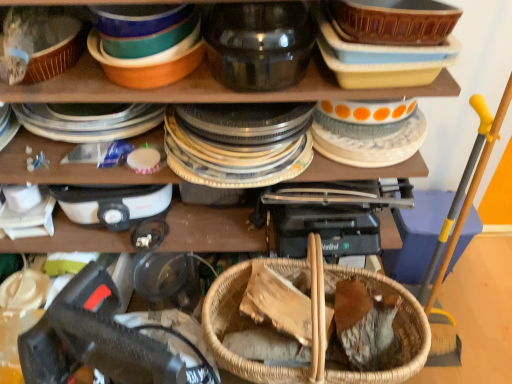
Question: Can you confirm if white glossy plate at upper right, the 2th tableware positioned from the left, is wider than woven wood basket at center?

Choices:
 (A) yes
 (B) no

Answer: (A)

Question: Can you confirm if white glossy plate at upper right, the 2th tableware positioned from the left, is shorter than woven wood basket at center?

Choices:
 (A) no
 (B) yes

Answer: (B)

Question: Does white glossy plate at upper right, the 2th tableware positioned from the left, contain woven wood basket at center?

Choices:
 (A) no
 (B) yes

Answer: (A)

Question: From the image's perspective, is white glossy plate at upper right, the 2th tableware positioned from the left, under woven wood basket at center?

Choices:
 (A) yes
 (B) no

Answer: (B)

Question: Is woven wood basket at center at the back of white glossy plate at upper right, the 2th tableware positioned from the left?

Choices:
 (A) yes
 (B) no

Answer: (B)

Question: Is white glossy plate at upper right, placed as the first tableware when sorted from right to left, bigger or smaller than white plastic appliance at upper left?

Choices:
 (A) big
 (B) small

Answer: (B)

Question: Considering the relative positions of white glossy plate at upper right, the 2th tableware positioned from the left, and white plastic appliance at upper left in the image provided, is white glossy plate at upper right, the 2th tableware positioned from the left, to the left or to the right of white plastic appliance at upper left?

Choices:
 (A) left
 (B) right

Answer: (B)

Question: From the image's perspective, is white glossy plate at upper right, placed as the first tableware when sorted from right to left, above or below white plastic appliance at upper left?

Choices:
 (A) below
 (B) above

Answer: (B)

Question: Does point (419, 135) appear closer or farther from the camera than point (102, 201)?

Choices:
 (A) closer
 (B) farther

Answer: (A)

Question: Based on their sizes in the image, would you say transparent glass jar at upper center, the second tableware in the right-to-left sequence, is bigger or smaller than woven wood basket at center?

Choices:
 (A) big
 (B) small

Answer: (B)

Question: Is transparent glass jar at upper center, the second tableware in the right-to-left sequence, spatially inside woven wood basket at center, or outside of it?

Choices:
 (A) outside
 (B) inside

Answer: (A)

Question: From a real-world perspective, is transparent glass jar at upper center, the second tableware in the right-to-left sequence, positioned above or below woven wood basket at center?

Choices:
 (A) below
 (B) above

Answer: (B)

Question: Considering their positions, is transparent glass jar at upper center, the first tableware from the left, located in front of or behind woven wood basket at center?

Choices:
 (A) front
 (B) behind

Answer: (A)

Question: From the image's perspective, is white plastic appliance at upper left above or below woven wood basket at center?

Choices:
 (A) below
 (B) above

Answer: (B)

Question: Considering the relative positions of white plastic appliance at upper left and woven wood basket at center in the image provided, is white plastic appliance at upper left to the left or to the right of woven wood basket at center?

Choices:
 (A) left
 (B) right

Answer: (A)